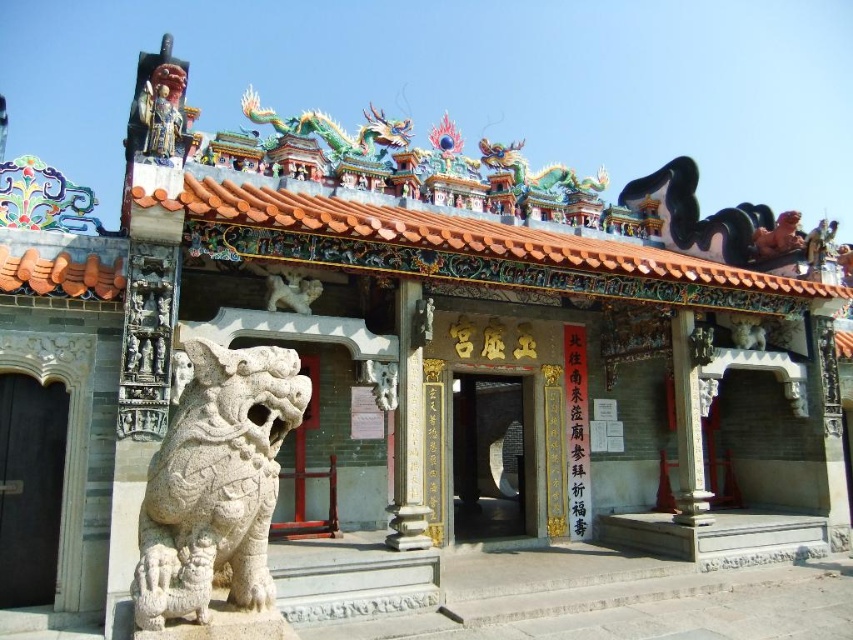
Can you confirm if white stone lion at lower left is shorter than matte painted wood statue at upper left?

No, white stone lion at lower left is not shorter than matte painted wood statue at upper left.

Between point (291, 364) and point (166, 74), which one is positioned behind?

The point (166, 74) is more distant.

What are the coordinates of `white stone lion at lower left` in the screenshot? It's located at (215, 486).

Does point (258, 534) lie in front of point (36, 516)?

Yes, point (258, 534) is closer to viewer.

Can you confirm if white stone lion at lower left is positioned above black wood door at lower left?

Yes, white stone lion at lower left is above black wood door at lower left.

Is point (201, 458) positioned behind point (27, 602)?

No.

Image resolution: width=853 pixels, height=640 pixels. Find the location of `white stone lion at lower left`. white stone lion at lower left is located at coordinates (215, 486).

Is white stone lion at lower left further to the viewer compared to dark gray stone door at center?

No.

At what (x,y) coordinates should I click in order to perform the action: click on white stone lion at lower left. Please return your answer as a coordinate pair (x, y). Image resolution: width=853 pixels, height=640 pixels. Looking at the image, I should click on (215, 486).